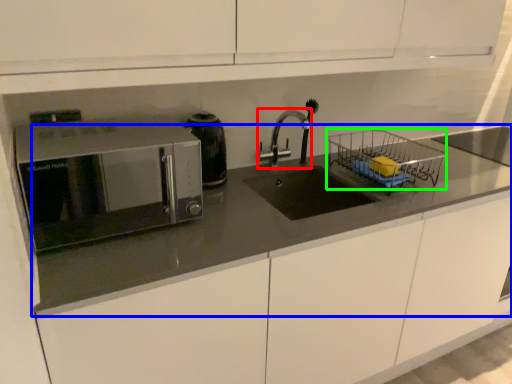
Question: Which object is the farthest from tap (highlighted by a red box)? Choose among these: countertop (highlighted by a blue box) or basket (highlighted by a green box).

Choices:
 (A) countertop
 (B) basket

Answer: (A)